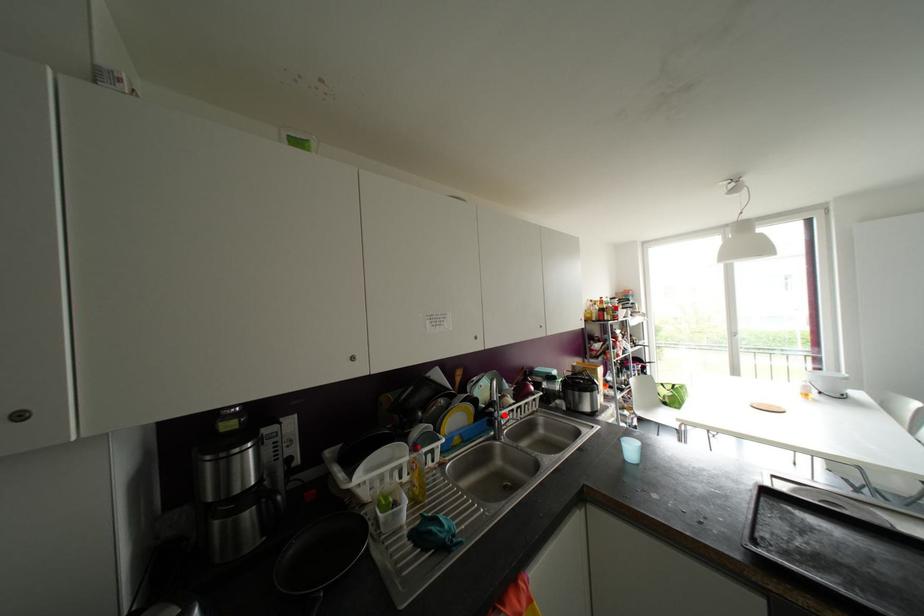
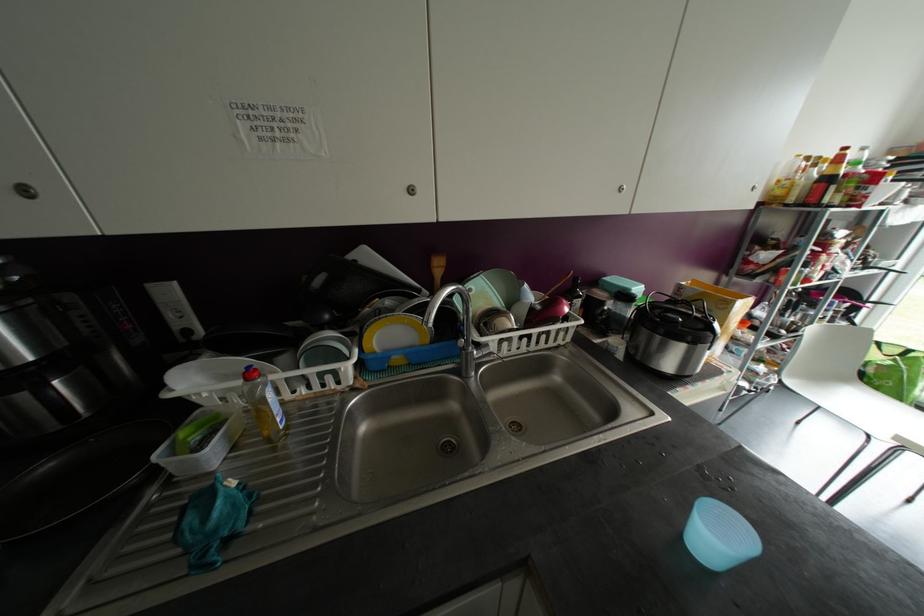
Where in the second image is the point corresponding to the highlighted location from the first image?

(487, 345)